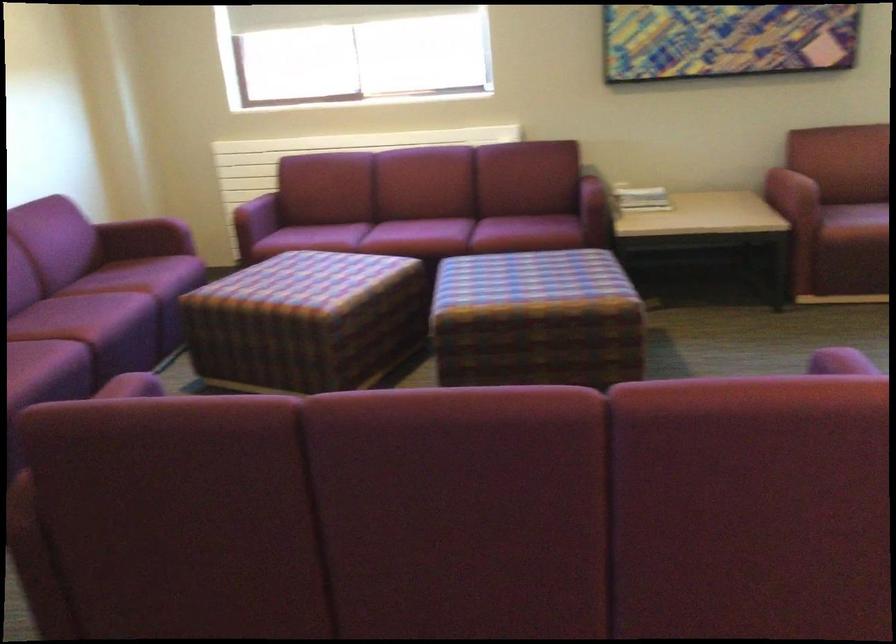
This screenshot has height=644, width=896. I want to click on purple sofa sitting surface, so click(x=116, y=313).